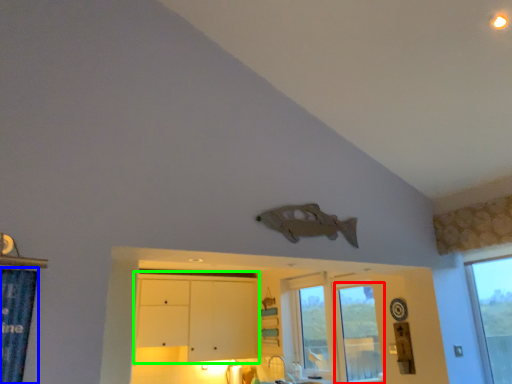
Question: Which object is the farthest from window (highlighted by a red box)? Choose among these: shower curtain (highlighted by a blue box) or dresser (highlighted by a green box).

Choices:
 (A) shower curtain
 (B) dresser

Answer: (A)